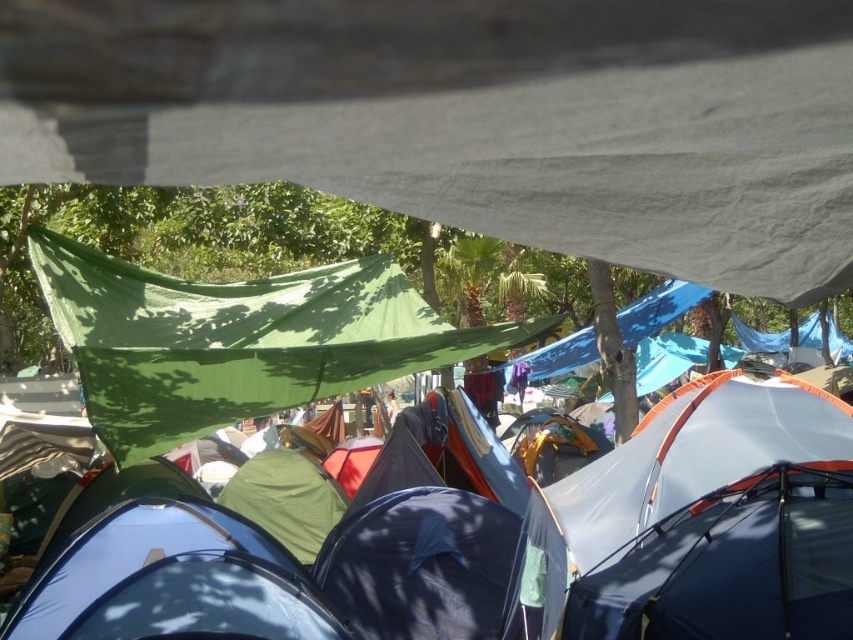
Who is positioned more to the left, green fabric tent at center or green fabric canopy at upper left?

green fabric canopy at upper left

Can you confirm if green fabric tent at center is thinner than green fabric canopy at upper left?

Indeed, green fabric tent at center has a lesser width compared to green fabric canopy at upper left.

Who is more distant from viewer, (225, 609) or (248, 320)?

The point (248, 320) is more distant.

Where is `green fabric tent at center`? green fabric tent at center is located at coordinates (700, 566).